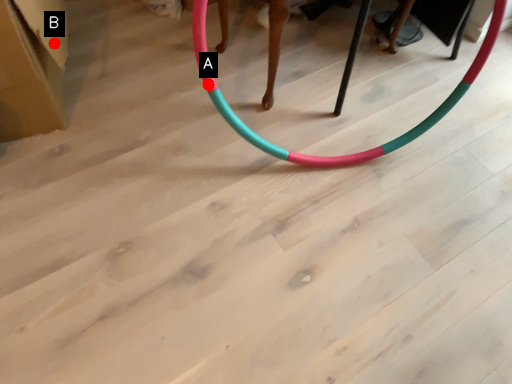
Question: Two points are circled on the image, labeled by A and B beside each circle. Which point is closer to the camera taking this photo?

Choices:
 (A) A is closer
 (B) B is closer

Answer: (A)